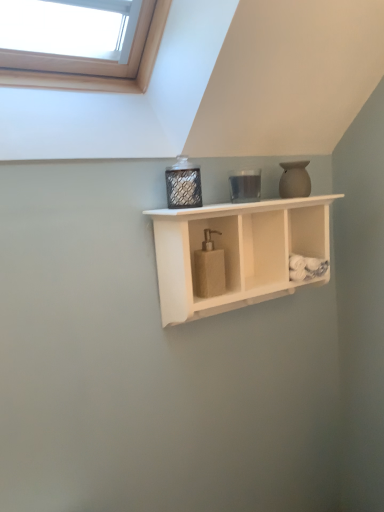
Question: Would you say white matte wood shelf at center is to the left or to the right of metallic mesh container at center in the picture?

Choices:
 (A) left
 (B) right

Answer: (B)

Question: Considering their positions, is white matte wood shelf at center located in front of or behind metallic mesh container at center?

Choices:
 (A) front
 (B) behind

Answer: (A)

Question: Based on their relative distances, which object is nearer to the white matte wood shelf at center?

Choices:
 (A) beige textured soap dispenser at center
 (B) matte beige vase at upper right
 (C) metallic mesh container at center

Answer: (A)

Question: Based on their relative distances, which object is farther from the metallic mesh container at center?

Choices:
 (A) beige textured soap dispenser at center
 (B) matte beige vase at upper right
 (C) white matte wood shelf at center

Answer: (B)